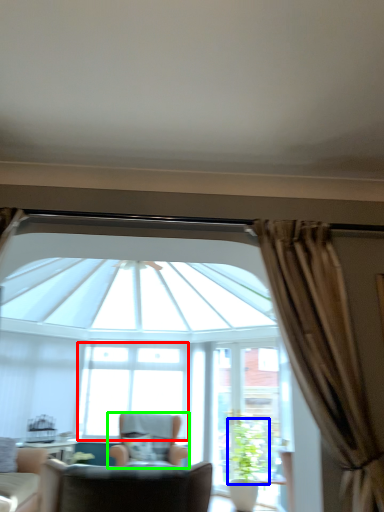
Question: Which object is the farthest from window (highlighted by a red box)? Choose among these: plant (highlighted by a blue box) or chair (highlighted by a green box).

Choices:
 (A) plant
 (B) chair

Answer: (A)